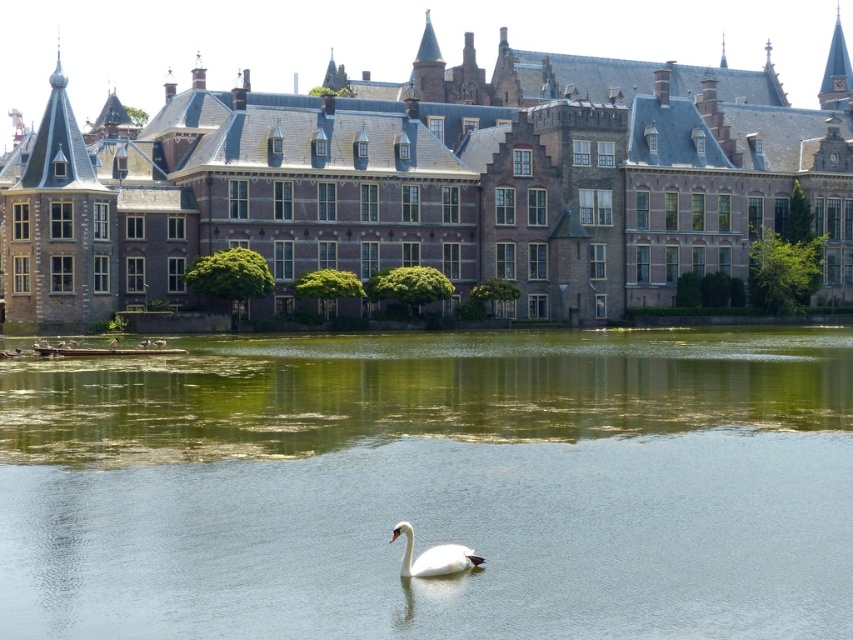
Find the location of a particular element. This screenshot has height=640, width=853. brown brick building at center is located at coordinates (428, 182).

Between brown brick building at center and white glossy swan at center, which one is positioned higher?

brown brick building at center

Which is behind, point (665, 83) or point (427, 561)?

Positioned behind is point (665, 83).

The image size is (853, 640). What are the coordinates of `brown brick building at center` in the screenshot? It's located at (428, 182).

Does clear water at center appear on the left side of white glossy swan at center?

Indeed, clear water at center is positioned on the left side of white glossy swan at center.

Does point (287, 531) come in front of point (434, 552)?

No.

Image resolution: width=853 pixels, height=640 pixels. I want to click on clear water at center, so click(433, 486).

You are a GUI agent. You are given a task and a screenshot of the screen. Output one action in this format:
    pyautogui.click(x=<x>, y=<y>)
    Task: Click on the clear water at center
    The width and height of the screenshot is (853, 640).
    Given the screenshot: What is the action you would take?
    pyautogui.click(x=433, y=486)

Is clear water at center taller than brown brick building at center?

No, clear water at center is not taller than brown brick building at center.

Can you confirm if clear water at center is thinner than brown brick building at center?

Indeed, clear water at center has a lesser width compared to brown brick building at center.

Who is more forward, (810,436) or (175,250)?

Point (810,436) is more forward.

Locate an element on the screen. The width and height of the screenshot is (853, 640). clear water at center is located at coordinates (433, 486).